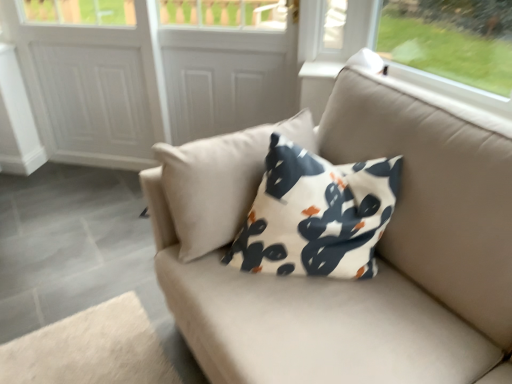
Question: From a real-world perspective, is white matte door at center, acting as the first screen door starting from the right, positioned over white matte screen door at upper center, which is the second screen door from right to left, based on gravity?

Choices:
 (A) yes
 (B) no

Answer: (A)

Question: From a real-world perspective, is white matte door at center, acting as the first screen door starting from the right, positioned under white matte screen door at upper center, which is the second screen door from right to left, based on gravity?

Choices:
 (A) yes
 (B) no

Answer: (B)

Question: Does white matte door at center, acting as the first screen door starting from the right, have a greater height compared to white matte screen door at upper center, which is the second screen door from right to left?

Choices:
 (A) yes
 (B) no

Answer: (B)

Question: Considering the relative positions of white matte door at center, acting as the first screen door starting from the right, and white matte screen door at upper center, which is the second screen door from right to left, in the image provided, is white matte door at center, acting as the first screen door starting from the right, to the left of white matte screen door at upper center, which is the second screen door from right to left, from the viewer's perspective?

Choices:
 (A) no
 (B) yes

Answer: (A)

Question: Is white matte door at center, acting as the first screen door starting from the right, oriented towards white matte screen door at upper center, which is the second screen door from right to left?

Choices:
 (A) yes
 (B) no

Answer: (A)

Question: Considering the relative sizes of white matte door at center, acting as the first screen door starting from the right, and white matte screen door at upper center, which is the second screen door from right to left, in the image provided, is white matte door at center, acting as the first screen door starting from the right, thinner than white matte screen door at upper center, which is the second screen door from right to left,?

Choices:
 (A) yes
 (B) no

Answer: (B)

Question: Is white matte door at center, the 3th screen door when ordered from left to right, shorter than white textured screen door at upper center, which ranks as the third screen door in right-to-left order?

Choices:
 (A) no
 (B) yes

Answer: (B)

Question: From the image's perspective, is white matte door at center, acting as the first screen door starting from the right, below white textured screen door at upper center, marked as the 1th screen door in a left-to-right arrangement?

Choices:
 (A) no
 (B) yes

Answer: (B)

Question: Is white matte door at center, the 3th screen door when ordered from left to right, wider than white textured screen door at upper center, marked as the 1th screen door in a left-to-right arrangement?

Choices:
 (A) no
 (B) yes

Answer: (B)

Question: From a real-world perspective, is white matte door at center, the 3th screen door when ordered from left to right, physically above white textured screen door at upper center, marked as the 1th screen door in a left-to-right arrangement?

Choices:
 (A) yes
 (B) no

Answer: (A)

Question: Can we say white matte door at center, the 3th screen door when ordered from left to right, lies outside white textured screen door at upper center, marked as the 1th screen door in a left-to-right arrangement?

Choices:
 (A) no
 (B) yes

Answer: (B)

Question: From a real-world perspective, is white matte door at center, acting as the first screen door starting from the right, positioned under white textured screen door at upper center, marked as the 1th screen door in a left-to-right arrangement, based on gravity?

Choices:
 (A) yes
 (B) no

Answer: (B)

Question: Is white matte screen door at upper center, which is the second screen door from right to left, with white matte door at center, acting as the first screen door starting from the right?

Choices:
 (A) yes
 (B) no

Answer: (B)